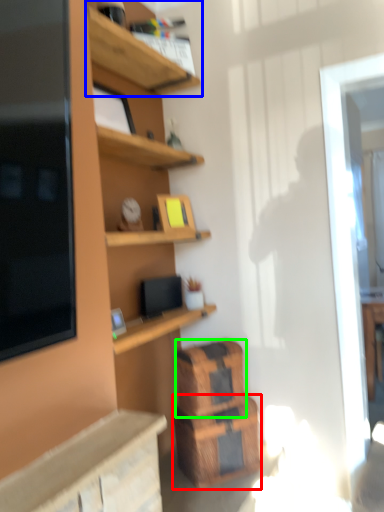
Question: Estimate the real-world distances between objects in this image. Which object is farther from crate (highlighted by a red box), shelf (highlighted by a blue box) or crate (highlighted by a green box)?

Choices:
 (A) shelf
 (B) crate

Answer: (A)